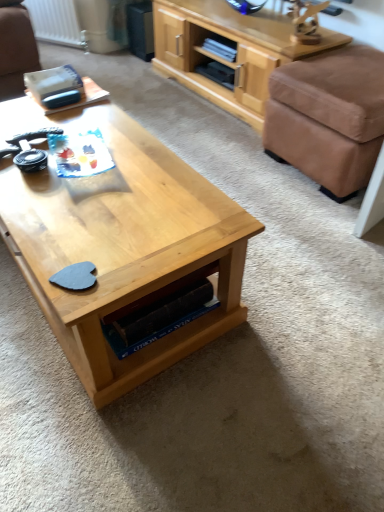
Question: Does light wood cabinet at upper right have a larger size compared to brown fabric ottoman at right?

Choices:
 (A) no
 (B) yes

Answer: (B)

Question: Is brown fabric ottoman at right completely or partially inside light wood cabinet at upper right?

Choices:
 (A) yes
 (B) no

Answer: (B)

Question: From a real-world perspective, is light wood cabinet at upper right over brown fabric ottoman at right?

Choices:
 (A) yes
 (B) no

Answer: (A)

Question: Is light wood cabinet at upper right not inside brown fabric ottoman at right?

Choices:
 (A) no
 (B) yes

Answer: (B)

Question: Is the depth of light wood cabinet at upper right greater than that of brown fabric ottoman at right?

Choices:
 (A) yes
 (B) no

Answer: (A)

Question: From a real-world perspective, is white painted metal radiator at upper left above or below brown fabric ottoman at right?

Choices:
 (A) below
 (B) above

Answer: (A)

Question: Would you say white painted metal radiator at upper left is to the left or to the right of brown fabric ottoman at right in the picture?

Choices:
 (A) right
 (B) left

Answer: (B)

Question: Is white painted metal radiator at upper left in front of or behind brown fabric ottoman at right in the image?

Choices:
 (A) front
 (B) behind

Answer: (B)

Question: Is point (87, 50) closer or farther from the camera than point (274, 156)?

Choices:
 (A) farther
 (B) closer

Answer: (A)

Question: Considering the positions of light wood cabinet at upper right and white painted metal radiator at upper left in the image, is light wood cabinet at upper right wider or thinner than white painted metal radiator at upper left?

Choices:
 (A) thin
 (B) wide

Answer: (B)

Question: Is light wood cabinet at upper right inside or outside of white painted metal radiator at upper left?

Choices:
 (A) outside
 (B) inside

Answer: (A)

Question: Based on their positions, is light wood cabinet at upper right located to the left or right of white painted metal radiator at upper left?

Choices:
 (A) right
 (B) left

Answer: (A)

Question: From the image's perspective, is light wood cabinet at upper right above or below white painted metal radiator at upper left?

Choices:
 (A) below
 (B) above

Answer: (A)

Question: Based on their sizes in the image, would you say brown fabric ottoman at right is bigger or smaller than light wood cabinet at upper right?

Choices:
 (A) big
 (B) small

Answer: (B)

Question: Based on their positions, is brown fabric ottoman at right located to the left or right of light wood cabinet at upper right?

Choices:
 (A) right
 (B) left

Answer: (A)